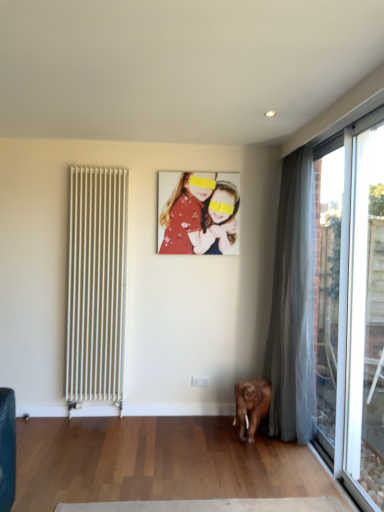
Question: Would you say white metal radiator at left is inside or outside matte floral dress at center?

Choices:
 (A) outside
 (B) inside

Answer: (A)

Question: Considering the positions of white metal radiator at left and matte floral dress at center in the image, is white metal radiator at left wider or thinner than matte floral dress at center?

Choices:
 (A) thin
 (B) wide

Answer: (B)

Question: Estimate the real-world distances between objects in this image. Which object is farther from the silky gray curtain at right?

Choices:
 (A) matte floral dress at center
 (B) transparent glass window at right, positioned as the 2th window in front-to-back order
 (C) white metal radiator at left
 (D) transparent glass door at right, the first window from the front

Answer: (C)

Question: Estimate the real-world distances between objects in this image. Which object is closer to the transparent glass window at right, positioned as the 2th window in front-to-back order?

Choices:
 (A) transparent glass door at right, the first window from the front
 (B) silky gray curtain at right
 (C) white metal radiator at left
 (D) matte floral dress at center

Answer: (B)